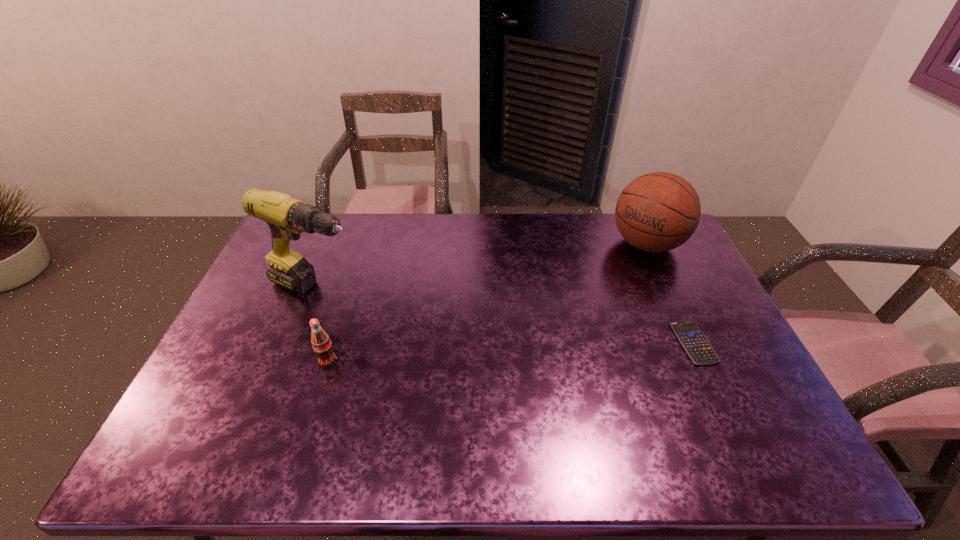
Find the location of a particular element. Image resolution: width=960 pixels, height=540 pixels. free region located on the handle side of the tallest object is located at coordinates (445, 332).

Find the location of `vacant space located on the side with brand label of the second tallest object`. vacant space located on the side with brand label of the second tallest object is located at coordinates (600, 293).

This screenshot has height=540, width=960. In order to click on vacant position located 0.100m on the side with brand label of the second tallest object in this screenshot , I will do `click(615, 277)`.

You are a GUI agent. You are given a task and a screenshot of the screen. Output one action in this format:
    pyautogui.click(x=<x>, y=<y>)
    Task: Click on the vacant space located on the side with brand label of the second tallest object
    The image size is (960, 540).
    Given the screenshot: What is the action you would take?
    click(x=587, y=307)

At what (x,y) coordinates should I click in order to perform the action: click on object at the far edge. Please return your answer as a coordinate pair (x, y). The height and width of the screenshot is (540, 960). Looking at the image, I should click on (657, 212).

Identify the location of object present at the left edge. This screenshot has width=960, height=540. (287, 217).

Where is `calculator that is at the right edge`? The image size is (960, 540). calculator that is at the right edge is located at coordinates (693, 340).

The height and width of the screenshot is (540, 960). I want to click on basketball located at the right edge, so click(x=657, y=212).

Locate an element on the screen. The width and height of the screenshot is (960, 540). object present at the far right corner is located at coordinates (657, 212).

The image size is (960, 540). In the image, there is a desktop. What are the coordinates of `free space at the far edge` in the screenshot? It's located at (441, 215).